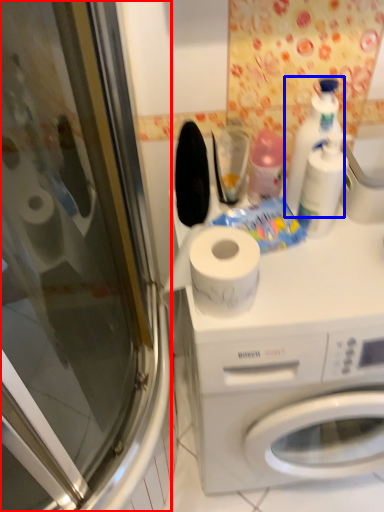
Question: Which object is closer to the camera taking this photo, screen door (highlighted by a red box) or cleaning product (highlighted by a blue box)?

Choices:
 (A) screen door
 (B) cleaning product

Answer: (A)